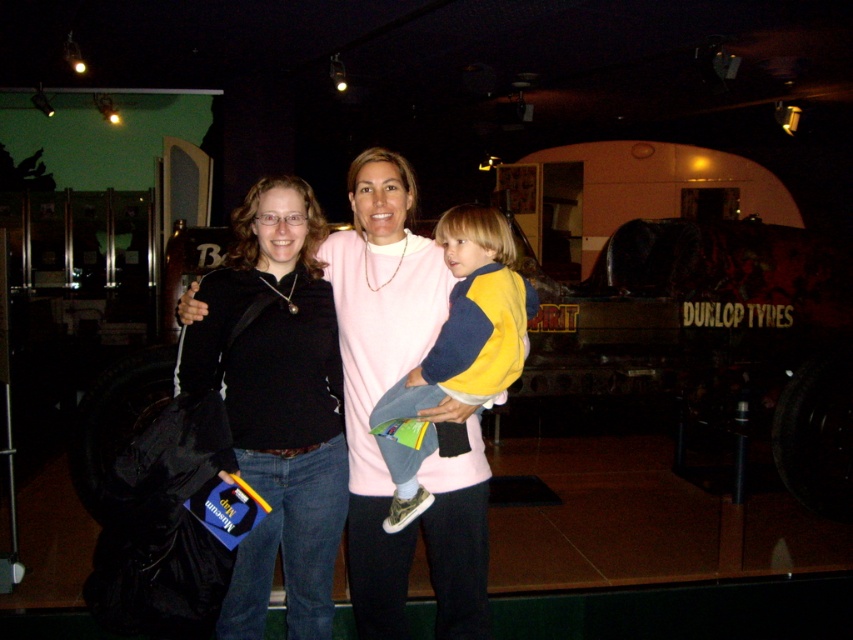
Question: Is pink matte sweater at center positioned in front of yellow-blue sweater at center?

Choices:
 (A) no
 (B) yes

Answer: (A)

Question: Which object appears closest to the camera in this image?

Choices:
 (A) yellow-blue sweater at center
 (B) pink matte sweater at center

Answer: (A)

Question: Is pink matte sweater at center below yellow-blue sweater at center?

Choices:
 (A) no
 (B) yes

Answer: (B)

Question: Does pink matte sweater at center lie behind yellow-blue sweater at center?

Choices:
 (A) yes
 (B) no

Answer: (A)

Question: Which of the following is the farthest from the observer?

Choices:
 (A) pink matte sweater at center
 (B) yellow-blue sweater at center

Answer: (A)